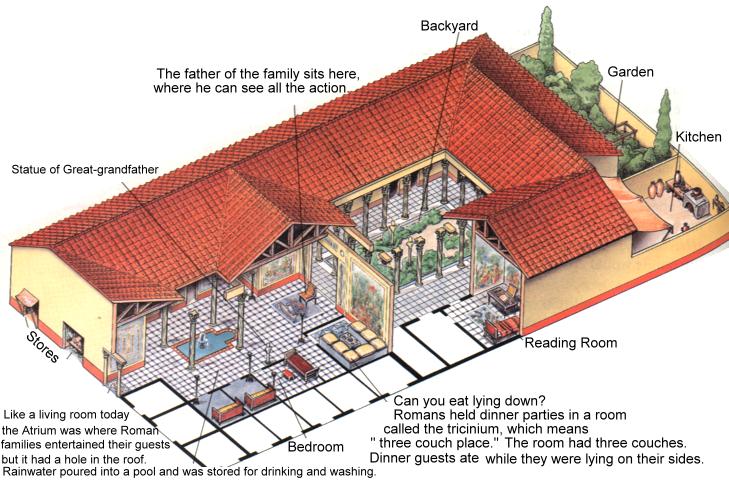
The width and height of the screenshot is (729, 480). I want to click on 1 statue, so (124, 174).